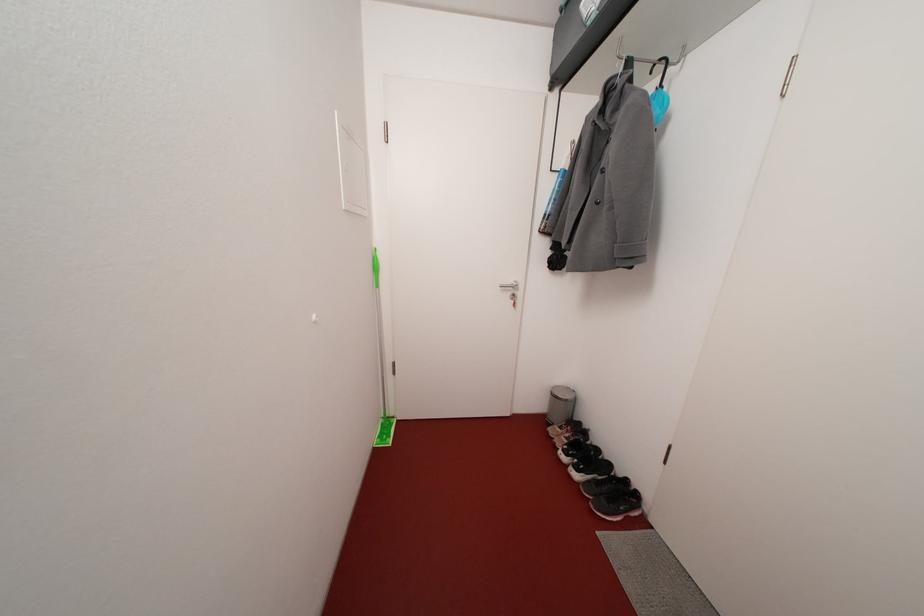
Find where to pull the black storage case. Please return your answer as a coordinate pair (x, y).

(581, 34)